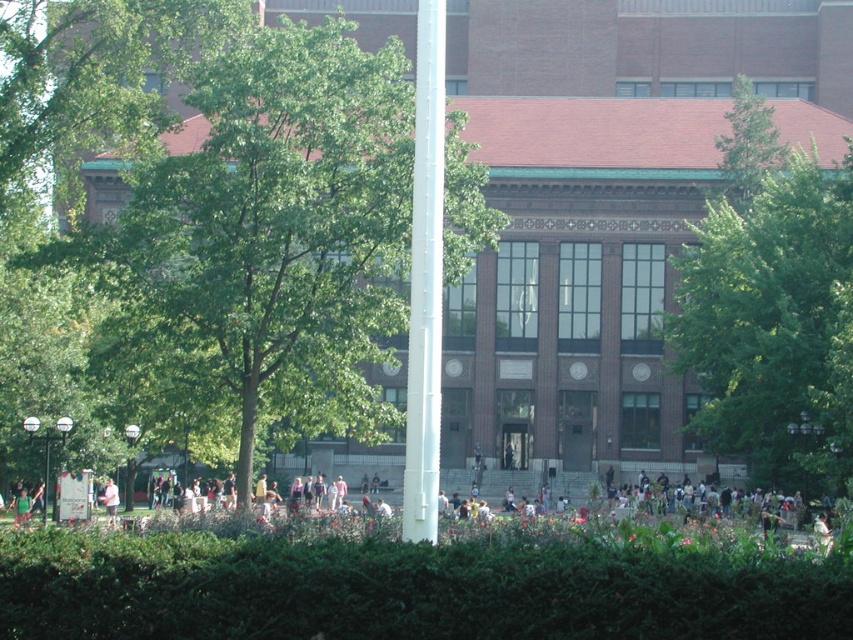
You are standing at the point marked by the coordinates point (769, 301) in the image. What object is directly in front of you?

The point (769, 301) corresponds to the green leafy tree at right, so the object directly in front of you is the green leafy tree at right.

You are standing in the garden and want to take a photo of the white metal pole at center without the metallic silver lamp post at center blocking it. How should you position yourself?

Move to the side of the metallic silver lamp post at center so that the white metal pole at center is visible behind it.

You are standing in front of the historic building and want to take a photo of both the green leafy tree at right and the metallic silver lamp post at center. Can you frame both objects in the same shot without moving your position?

The green leafy tree at right is located above the metallic silver lamp post at center, so you can frame both objects in the same shot by adjusting your camera angle to include the tree above and the lamp post below without moving your position.